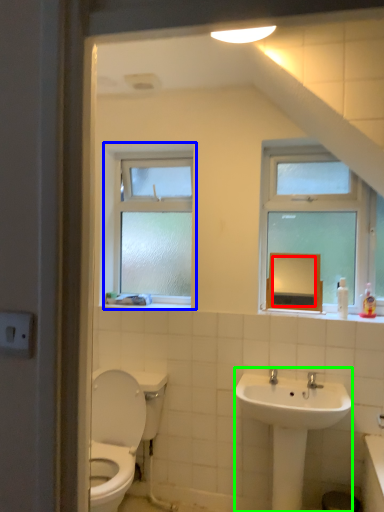
Question: Which object is the closest to the mirror (highlighted by a red box)? Choose among these: window (highlighted by a blue box) or sink (highlighted by a green box).

Choices:
 (A) window
 (B) sink

Answer: (B)